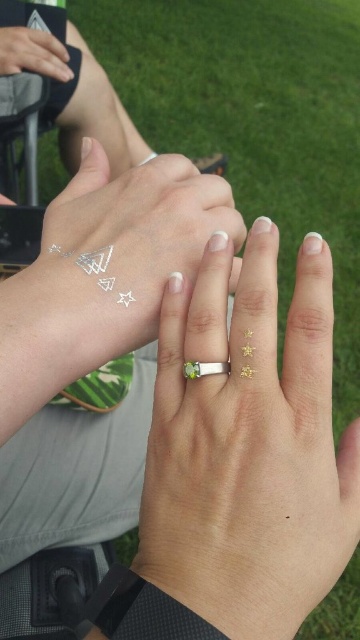
Is point (99, 314) positioned in front of point (206, 364)?

No, it is behind (206, 364).

Is silver metallic temporary tattoo at upper left behind green gemstone ring at center?

No.

Between point (176, 205) and point (196, 365), which one is positioned behind?

Positioned behind is point (176, 205).

At what (x,y) coordinates should I click in order to perform the action: click on silver metallic temporary tattoo at upper left. Please return your answer as a coordinate pair (x, y). Looking at the image, I should click on (108, 266).

Can you confirm if silver/gold ring at center is positioned above silver metallic temporary tattoo at upper left?

Actually, silver/gold ring at center is below silver metallic temporary tattoo at upper left.

Is silver/gold ring at center further to the viewer compared to silver metallic temporary tattoo at upper left?

No, it is in front of silver metallic temporary tattoo at upper left.

I want to click on silver/gold ring at center, so click(x=249, y=445).

Consider the image. Does silver/gold ring at center have a lesser height compared to green gemstone ring at center?

No.

Based on the photo, which is above, silver/gold ring at center or green gemstone ring at center?

green gemstone ring at center is above.

This screenshot has width=360, height=640. Describe the element at coordinates (249, 445) in the screenshot. I see `silver/gold ring at center` at that location.

This screenshot has height=640, width=360. I want to click on silver/gold ring at center, so click(x=249, y=445).